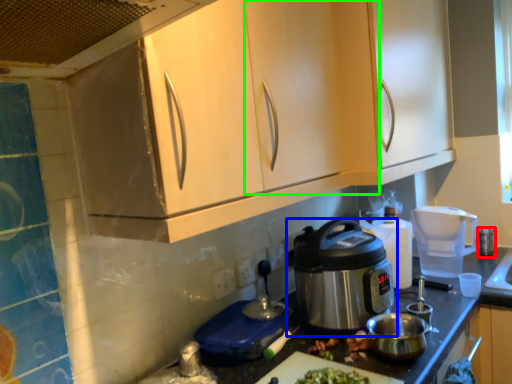
Question: Which object is positioned closest to appliance (highlighted by a red box)? Select from home appliance (highlighted by a blue box) and cabinetry (highlighted by a green box).

Choices:
 (A) home appliance
 (B) cabinetry

Answer: (A)